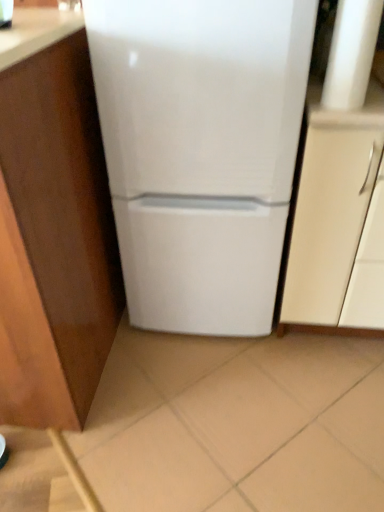
Question: Should I look upward or downward to see white glossy refrigerator at center?

Choices:
 (A) up
 (B) down

Answer: (A)

Question: Considering the relative sizes of matte white cabinet at right, which appears as the 2th cabinetry when viewed from the left, and white glossy refrigerator at center in the image provided, is matte white cabinet at right, which appears as the 2th cabinetry when viewed from the left, taller than white glossy refrigerator at center?

Choices:
 (A) no
 (B) yes

Answer: (A)

Question: Are matte white cabinet at right, which appears as the 2th cabinetry when viewed from the left, and white glossy refrigerator at center far apart?

Choices:
 (A) yes
 (B) no

Answer: (B)

Question: Is the position of matte white cabinet at right, positioned as the first cabinetry in right-to-left order, more distant than that of white glossy refrigerator at center?

Choices:
 (A) yes
 (B) no

Answer: (A)

Question: Is matte white cabinet at right, which appears as the 2th cabinetry when viewed from the left, directly adjacent to white glossy refrigerator at center?

Choices:
 (A) no
 (B) yes

Answer: (A)

Question: Considering the relative sizes of matte white cabinet at right, which appears as the 2th cabinetry when viewed from the left, and white glossy refrigerator at center in the image provided, is matte white cabinet at right, which appears as the 2th cabinetry when viewed from the left, shorter than white glossy refrigerator at center?

Choices:
 (A) yes
 (B) no

Answer: (A)

Question: Is matte white cabinet at right, positioned as the first cabinetry in right-to-left order, in front of white glossy refrigerator at center?

Choices:
 (A) yes
 (B) no

Answer: (B)

Question: Is wooden cabinet at left, the first cabinetry viewed from the left, bigger than matte white cabinet at right, which appears as the 2th cabinetry when viewed from the left?

Choices:
 (A) no
 (B) yes

Answer: (B)

Question: From a real-world perspective, is wooden cabinet at left, positioned as the second cabinetry in right-to-left order, positioned under matte white cabinet at right, which appears as the 2th cabinetry when viewed from the left, based on gravity?

Choices:
 (A) yes
 (B) no

Answer: (B)

Question: Does wooden cabinet at left, positioned as the second cabinetry in right-to-left order, turn towards matte white cabinet at right, which appears as the 2th cabinetry when viewed from the left?

Choices:
 (A) no
 (B) yes

Answer: (A)

Question: Is wooden cabinet at left, positioned as the second cabinetry in right-to-left order, wider than matte white cabinet at right, which appears as the 2th cabinetry when viewed from the left?

Choices:
 (A) no
 (B) yes

Answer: (A)

Question: Is wooden cabinet at left, the first cabinetry viewed from the left, further to camera compared to matte white cabinet at right, positioned as the first cabinetry in right-to-left order?

Choices:
 (A) yes
 (B) no

Answer: (B)

Question: Can you confirm if wooden cabinet at left, the first cabinetry viewed from the left, is taller than matte white cabinet at right, positioned as the first cabinetry in right-to-left order?

Choices:
 (A) no
 (B) yes

Answer: (B)

Question: Is white glossy refrigerator at center closer to the viewer compared to matte white cabinet at right, positioned as the first cabinetry in right-to-left order?

Choices:
 (A) no
 (B) yes

Answer: (B)